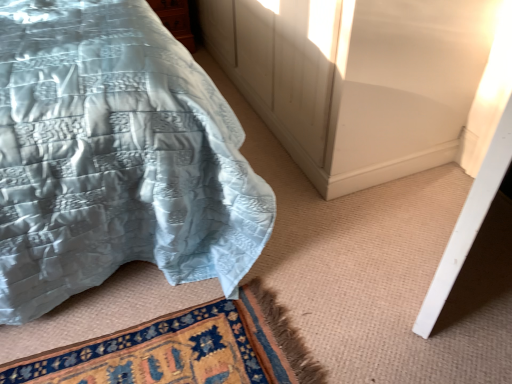
Question: Is wooden cabinet at upper left facing towards silky blue quilt at upper left?

Choices:
 (A) no
 (B) yes

Answer: (A)

Question: Is the depth of wooden cabinet at upper left less than that of silky blue quilt at upper left?

Choices:
 (A) no
 (B) yes

Answer: (A)

Question: Can you confirm if wooden cabinet at upper left is wider than silky blue quilt at upper left?

Choices:
 (A) no
 (B) yes

Answer: (A)

Question: Can you confirm if wooden cabinet at upper left is taller than silky blue quilt at upper left?

Choices:
 (A) yes
 (B) no

Answer: (B)

Question: From the image's perspective, is wooden cabinet at upper left beneath silky blue quilt at upper left?

Choices:
 (A) no
 (B) yes

Answer: (A)

Question: From the image's perspective, does wooden cabinet at upper left appear higher than silky blue quilt at upper left?

Choices:
 (A) no
 (B) yes

Answer: (B)

Question: Can you confirm if silky blue quilt at upper left is taller than wooden cabinet at upper left?

Choices:
 (A) yes
 (B) no

Answer: (A)

Question: From the image's perspective, is silky blue quilt at upper left beneath wooden cabinet at upper left?

Choices:
 (A) yes
 (B) no

Answer: (A)

Question: From a real-world perspective, is silky blue quilt at upper left on top of wooden cabinet at upper left?

Choices:
 (A) yes
 (B) no

Answer: (A)

Question: Can you confirm if silky blue quilt at upper left is positioned to the left of wooden cabinet at upper left?

Choices:
 (A) yes
 (B) no

Answer: (A)

Question: Is silky blue quilt at upper left turned away from wooden cabinet at upper left?

Choices:
 (A) yes
 (B) no

Answer: (B)

Question: Is silky blue quilt at upper left outside wooden cabinet at upper left?

Choices:
 (A) no
 (B) yes

Answer: (B)

Question: Would you say wooden cabinet at upper left is to the left or to the right of silky blue quilt at upper left in the picture?

Choices:
 (A) left
 (B) right

Answer: (B)